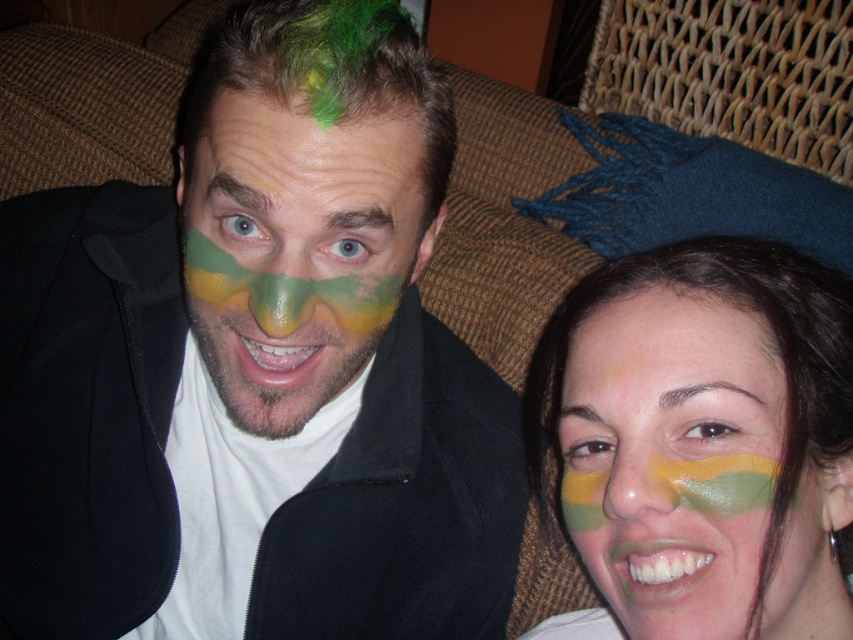
You are an interior designer assessing the layout of this living room. The matte black jacket at center is located at point (x=259, y=355). If you want to place a small table exactly 0.1 units to the right of this point, what coordinate would that be?

The coordinate (x=259, y=355) plus 0.1 to the right would be 0.655, 0.305. So the small table should be placed at point 0.655, 0.305.

You are a photographer setting up a shoot in the room. You have a matte black jacket at center and a green matte paint at lower right. Which object is closer to the left side of the frame?

The matte black jacket at center is positioned on the left side of green matte paint at lower right, so it is closer to the left side of the frame.

In the scene shown: You are an artist observing two green matte paint areas in the scene. Which one is nearer to you, the green matte paint at lower right or the green matte paint at center?

The green matte paint at lower right is closer to the viewer than the green matte paint at center.